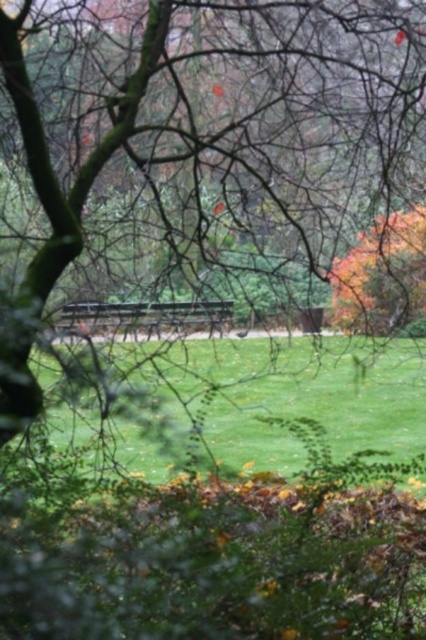
Question: Observing the image, what is the correct spatial positioning of green grassy at center in reference to wooden park bench at center?

Choices:
 (A) above
 (B) below

Answer: (B)

Question: Does green grassy at center have a greater width compared to wooden park bench at center?

Choices:
 (A) yes
 (B) no

Answer: (A)

Question: Does green grassy at center appear on the left side of wooden park bench at center?

Choices:
 (A) no
 (B) yes

Answer: (A)

Question: Which object appears closest to the camera in this image?

Choices:
 (A) wooden park bench at center
 (B) green grassy at center

Answer: (A)

Question: Among these points, which one is nearest to the camera?

Choices:
 (A) (319, 378)
 (B) (204, 305)

Answer: (B)